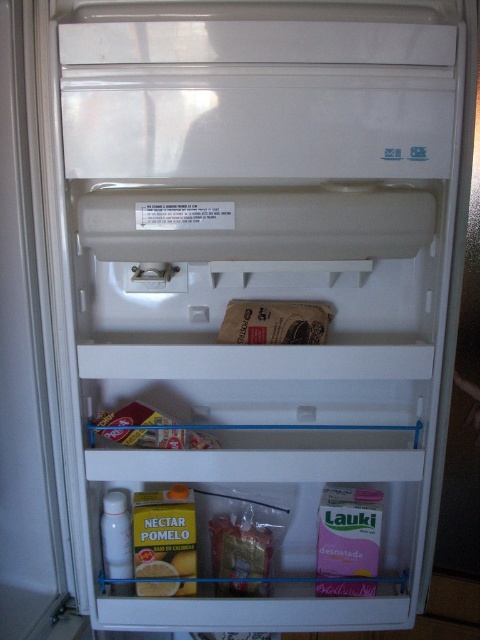
You are organizing items in the refrigerator and need to place both the brown paper bag at center and the matte cardboard box at center on the same shelf. Which item should you place first to ensure they both fit?

You should place the matte cardboard box at center first because it is larger than the brown paper bag at center, allowing you to position it appropriately and then fit the smaller bag next to or around it.

You are organizing items in a refrigerator and need to place the translucent plastic bag at lower center and the matte cardboard box at center on the same shelf. Which item will take up less space in the depth direction?

The translucent plastic bag at lower center is thinner than the matte cardboard box at center, so it will take up less space in the depth direction.

You are organizing groceries in your fridge and see the brown paper bag at center and the translucent plastic bag at lower center. Which bag can you place a wider item inside without needing to adjust its position?

The brown paper bag at center has a greater width than the translucent plastic bag at lower center, so you can place a wider item inside the brown paper bag at center without needing to adjust its position.